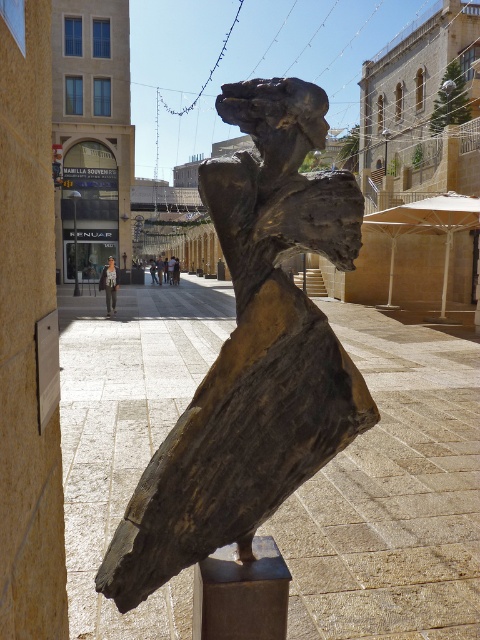
You are standing in front of the bronze sculpture and want to take a photo that includes both the point at coordinates point (370, 401) and point (106, 305). Which point should you focus on first to ensure both are in focus?

You should focus on point (106, 305) first because it is farther away from the viewer than point (370, 401), so focusing on the farther point will help ensure both are in focus.

You are an artist standing in the square and want to sketch the bronze statue at center and the light brown leather jacket at center. Based on their sizes, which one should you focus on first to capture their proportions accurately?

The bronze statue at center has a lesser height compared to the light brown leather jacket at center, so you should focus on the light brown leather jacket at center first because it is taller and its proportions will be more prominent in the sketch.

You are standing in the square and want to take a photo of the bronze statue at center without anyone else in the frame. Given that the statue is 1.68 meters away from you, can you step back to ensure there are no people in the photo? Explain your reasoning.

The bronze statue at center is 1.68 meters away from the viewer. Since the statue is close, stepping back might allow you to frame the photo without people in the foreground, but the distance is relatively short. However, the description does not mention the presence or position of other people, so it is unclear if stepping back would ensure no one is in the frame. The answer should focus on the given distance and not assume other details.